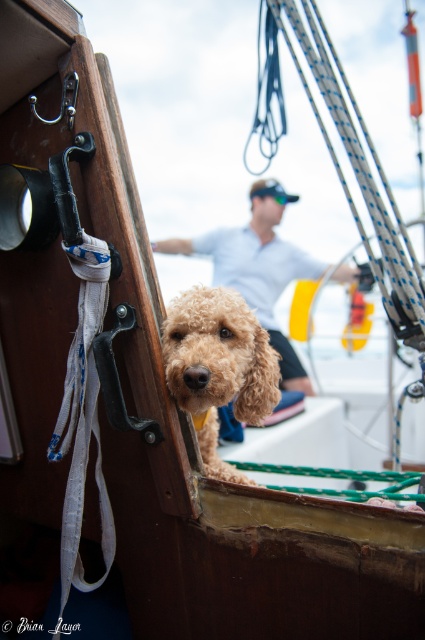
Question: Is fuzzy golden dog at center below white cotton shirt at center?

Choices:
 (A) no
 (B) yes

Answer: (B)

Question: Which point appears closest to the camera in this image?

Choices:
 (A) (261, 346)
 (B) (215, 234)

Answer: (A)

Question: Can you confirm if fuzzy golden dog at center is positioned to the left of white cotton shirt at center?

Choices:
 (A) no
 (B) yes

Answer: (B)

Question: Which object is farther from the camera taking this photo?

Choices:
 (A) white cotton shirt at center
 (B) fuzzy golden dog at center

Answer: (A)

Question: Which object appears closest to the camera in this image?

Choices:
 (A) white cotton shirt at center
 (B) fuzzy golden dog at center

Answer: (B)

Question: Can you confirm if fuzzy golden dog at center is wider than white cotton shirt at center?

Choices:
 (A) yes
 (B) no

Answer: (B)